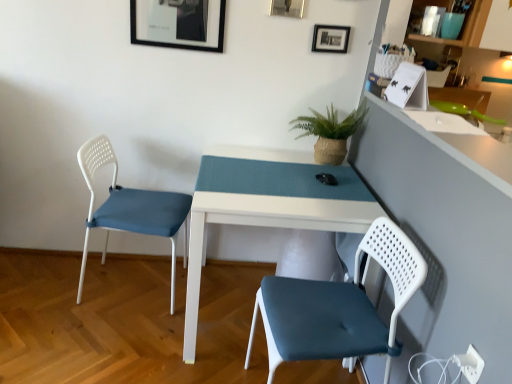
Question: Is matte black picture frame at upper center, marked as the 3th picture frame in a right-to-left arrangement, wider or thinner than white matte table at center?

Choices:
 (A) thin
 (B) wide

Answer: (A)

Question: Would you say matte black picture frame at upper center, marked as the 3th picture frame in a right-to-left arrangement, is to the left or to the right of white matte table at center in the picture?

Choices:
 (A) left
 (B) right

Answer: (A)

Question: Which is farther from the white matte table at center?

Choices:
 (A) matte black picture frame at upper center, marked as the 3th picture frame in a right-to-left arrangement
 (B) black matte picture frame at upper center, which appears as the 3th picture frame when viewed from the left
 (C) white plastic chair at left, which is the second chair from right to left
 (D) matte white chair at lower right, which appears as the second chair when viewed from the back
 (E) matte glass shelf at upper right

Answer: (E)

Question: Considering the real-world distances, which object is closest to the black matte picture frame at upper center, which is the 1th picture frame from right to left?

Choices:
 (A) matte glass shelf at upper right
 (B) green woven pot at upper center
 (C) metallic silver picture frame at upper center, acting as the second picture frame starting from the right
 (D) matte white chair at lower right, the 1th chair from the right
 (E) white matte table at center

Answer: (C)